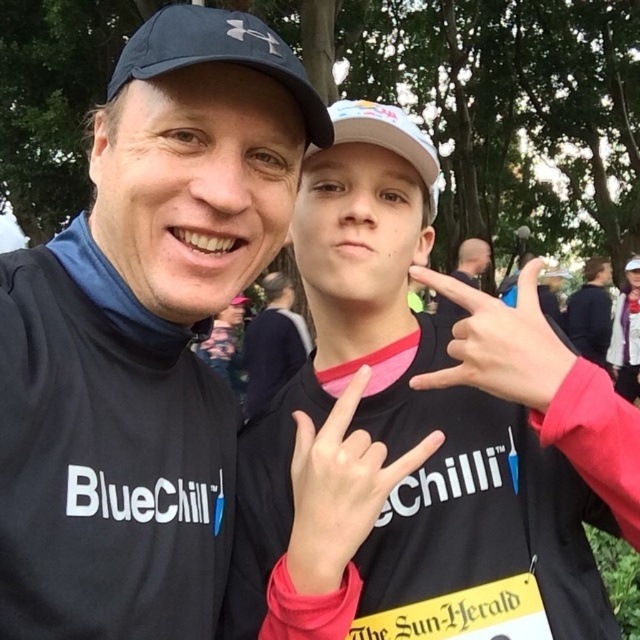
Who is higher up, black matte shirt at center or black matte t-shirt at center?

black matte t-shirt at center is higher up.

Is black matte shirt at center bigger than black matte t-shirt at center?

Yes, black matte shirt at center is bigger than black matte t-shirt at center.

Is point (531, 365) positioned after point (262, 141)?

No, (531, 365) is closer to viewer.

This screenshot has height=640, width=640. Identify the location of black matte shirt at center. (422, 435).

Image resolution: width=640 pixels, height=640 pixels. Describe the element at coordinates (144, 336) in the screenshot. I see `black matte t-shirt at center` at that location.

Does black matte t-shirt at center appear under white matte hand at center?

Incorrect, black matte t-shirt at center is not positioned below white matte hand at center.

Where is `black matte t-shirt at center`? The width and height of the screenshot is (640, 640). black matte t-shirt at center is located at coordinates (144, 336).

Find the location of a particular element. Image resolution: width=640 pixels, height=640 pixels. black matte t-shirt at center is located at coordinates (144, 336).

Which of these two, black matte shirt at center or white matte hand at center, stands shorter?

white matte hand at center is shorter.

Is black matte shirt at center closer to camera compared to white matte hand at center?

Yes.

What do you see at coordinates (422, 435) in the screenshot?
I see `black matte shirt at center` at bounding box center [422, 435].

Identify the location of black matte shirt at center. (422, 435).